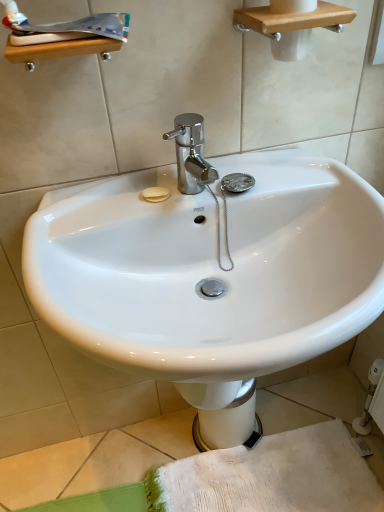
Question: From the image's perspective, is white glossy bidet at center over white glossy toothpaste at upper left?

Choices:
 (A) yes
 (B) no

Answer: (B)

Question: Is white glossy bidet at center further to the viewer compared to white glossy toothpaste at upper left?

Choices:
 (A) no
 (B) yes

Answer: (B)

Question: Is white glossy bidet at center positioned before white glossy toothpaste at upper left?

Choices:
 (A) yes
 (B) no

Answer: (B)

Question: Can you confirm if white glossy bidet at center is thinner than white glossy toothpaste at upper left?

Choices:
 (A) yes
 (B) no

Answer: (B)

Question: From a real-world perspective, is white glossy bidet at center on top of white glossy toothpaste at upper left?

Choices:
 (A) yes
 (B) no

Answer: (B)

Question: From a real-world perspective, is white glossy bidet at center below white glossy toothpaste at upper left?

Choices:
 (A) yes
 (B) no

Answer: (A)

Question: Can you confirm if white glossy toothpaste at upper left is positioned to the right of white glossy sink at center?

Choices:
 (A) yes
 (B) no

Answer: (B)

Question: Is white glossy toothpaste at upper left facing away from white glossy sink at center?

Choices:
 (A) yes
 (B) no

Answer: (B)

Question: Is white glossy toothpaste at upper left not within white glossy sink at center?

Choices:
 (A) no
 (B) yes

Answer: (B)

Question: Is white glossy toothpaste at upper left smaller than white glossy sink at center?

Choices:
 (A) no
 (B) yes

Answer: (B)

Question: Is white glossy toothpaste at upper left taller than white glossy sink at center?

Choices:
 (A) yes
 (B) no

Answer: (B)

Question: Can you confirm if white glossy toothpaste at upper left is wider than white glossy sink at center?

Choices:
 (A) yes
 (B) no

Answer: (B)

Question: From a real-world perspective, is white glossy toothpaste at upper left positioned over white glossy bidet at center based on gravity?

Choices:
 (A) yes
 (B) no

Answer: (A)